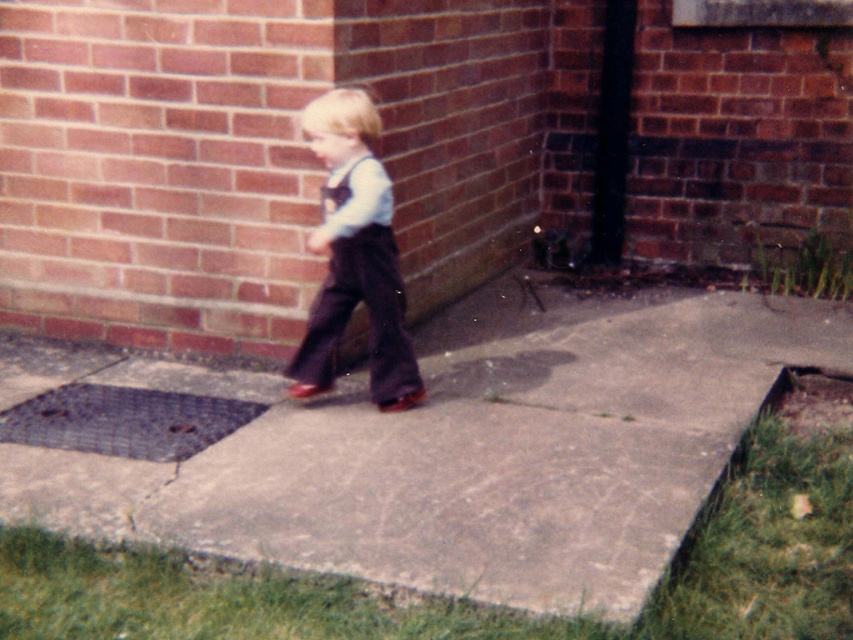
You are standing at the point marked by the coordinates point (451, 445) in the image. Looking around, you see a gray concrete at center. What is directly under your feet?

The point marked by the coordinates point (451, 445) marks gray concrete at center, so the gray concrete at center is directly under your feet.

From the picture: The child is wearing brown corduroy overalls at center and white fabric suspenders at center. Which clothing item is bigger?

The brown corduroy overalls at center is larger in size than the white fabric suspenders at center.